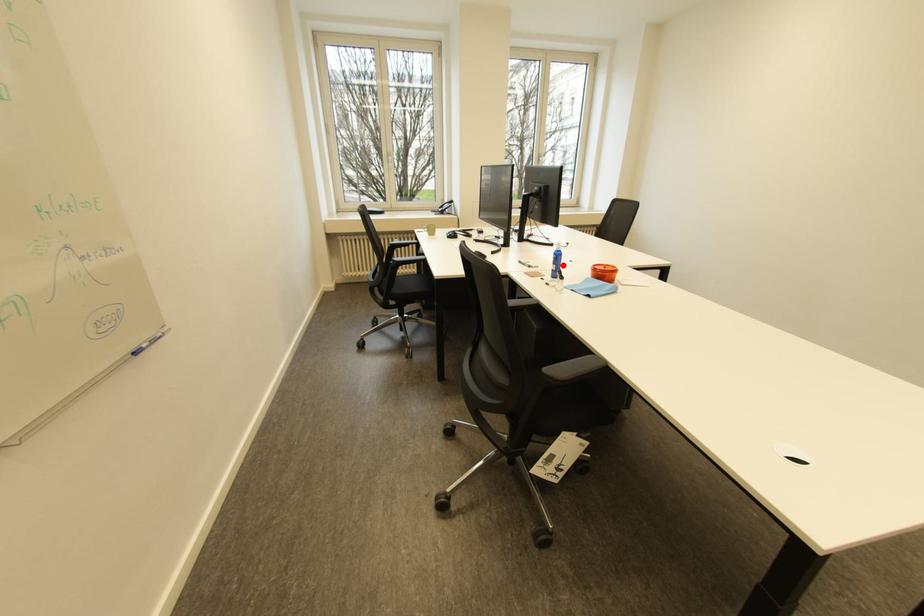
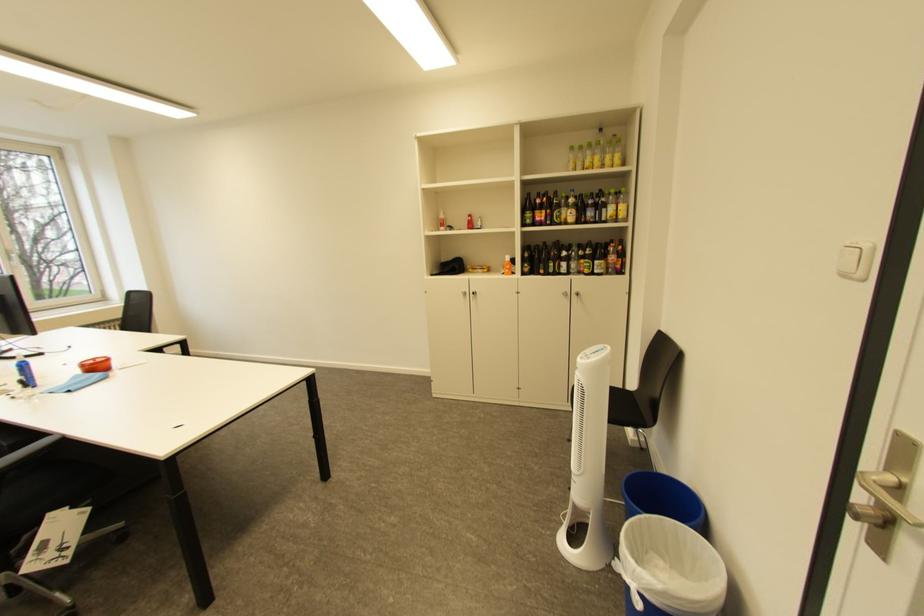
Find the pixel in the second image that matches the highlighted location in the first image.

(30, 378)